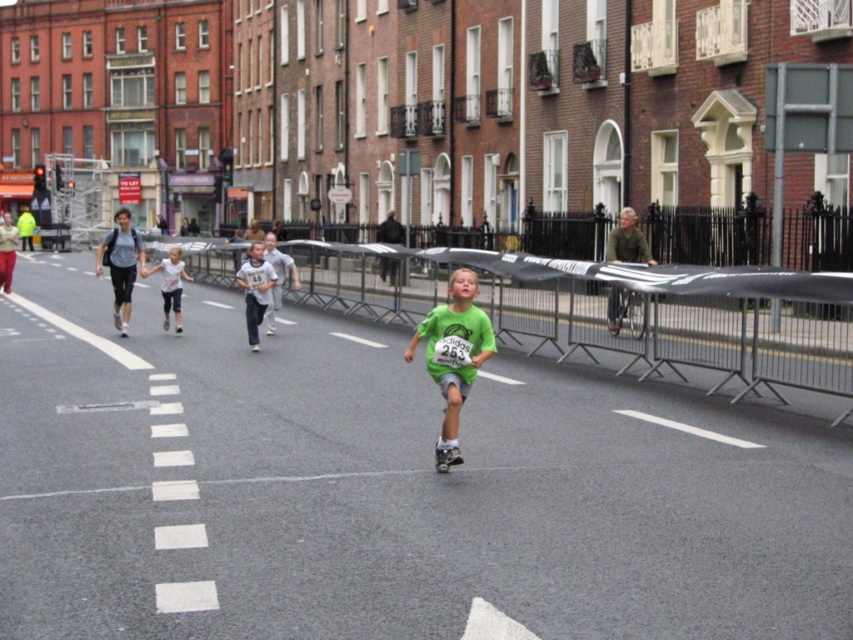
Does green matte shirt at center appear on the left side of light blue denim shorts at center?

Incorrect, green matte shirt at center is not on the left side of light blue denim shorts at center.

This screenshot has width=853, height=640. Describe the element at coordinates (453, 355) in the screenshot. I see `green matte shirt at center` at that location.

Identify the location of green matte shirt at center. (453, 355).

Which is behind, point (248, 253) or point (171, 273)?

Point (248, 253)

Can you confirm if light gray cotton shirt at center is positioned to the right of light blue denim shorts at center?

Yes, light gray cotton shirt at center is to the right of light blue denim shorts at center.

This screenshot has width=853, height=640. I want to click on light gray cotton shirt at center, so click(x=254, y=289).

Identify the location of green matte shirt at center. (453, 355).

Which is more to the right, green matte shirt at center or green textured shirt at center?

From the viewer's perspective, green textured shirt at center appears more on the right side.

Does point (460, 317) come in front of point (631, 216)?

Yes, it is in front of point (631, 216).

Find the location of a particular element. This screenshot has height=640, width=853. green matte shirt at center is located at coordinates (453, 355).